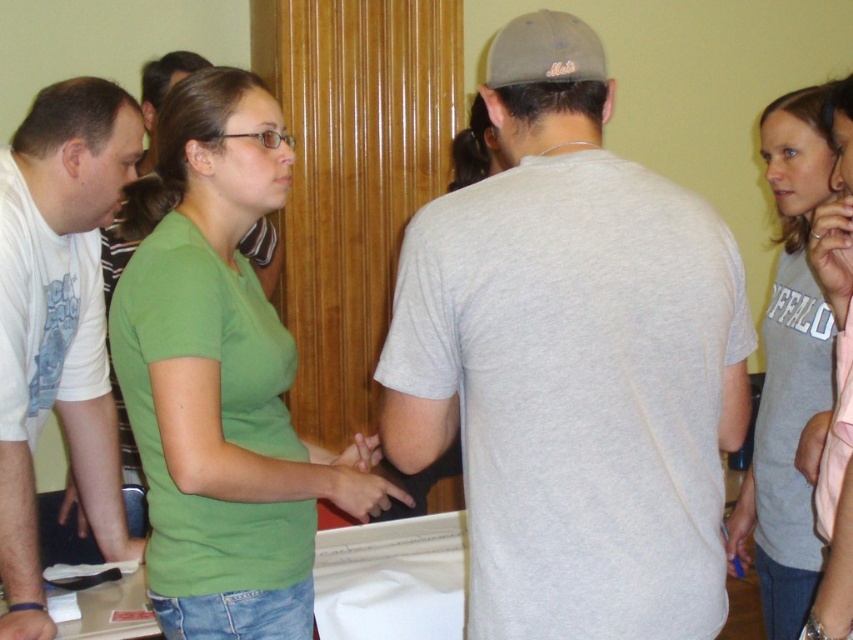
Measure the distance between point [679,611] and camera.

The distance of point [679,611] from camera is 1.23 meters.

Is point (618, 602) positioned behind point (270, 518)?

No, (618, 602) is closer to viewer.

The width and height of the screenshot is (853, 640). I want to click on gray cotton t-shirt at center, so click(x=572, y=364).

Can you confirm if white matte t-shirt at left is shorter than pink fabric shirt at upper right?

Incorrect, white matte t-shirt at left's height does not fall short of pink fabric shirt at upper right's.

Is point (90, 380) positioned in front of point (846, 400)?

No.

Where is `white matte t-shirt at left`? The width and height of the screenshot is (853, 640). white matte t-shirt at left is located at coordinates (57, 323).

Is gray cotton shirt at upper right wider than pink fabric shirt at upper right?

In fact, gray cotton shirt at upper right might be narrower than pink fabric shirt at upper right.

Who is lower down, gray cotton shirt at upper right or pink fabric shirt at upper right?

Positioned lower is gray cotton shirt at upper right.

Who is more forward, (767, 406) or (837, 116)?

Point (837, 116) is more forward.

Where is `gray cotton shirt at upper right`? gray cotton shirt at upper right is located at coordinates (790, 368).